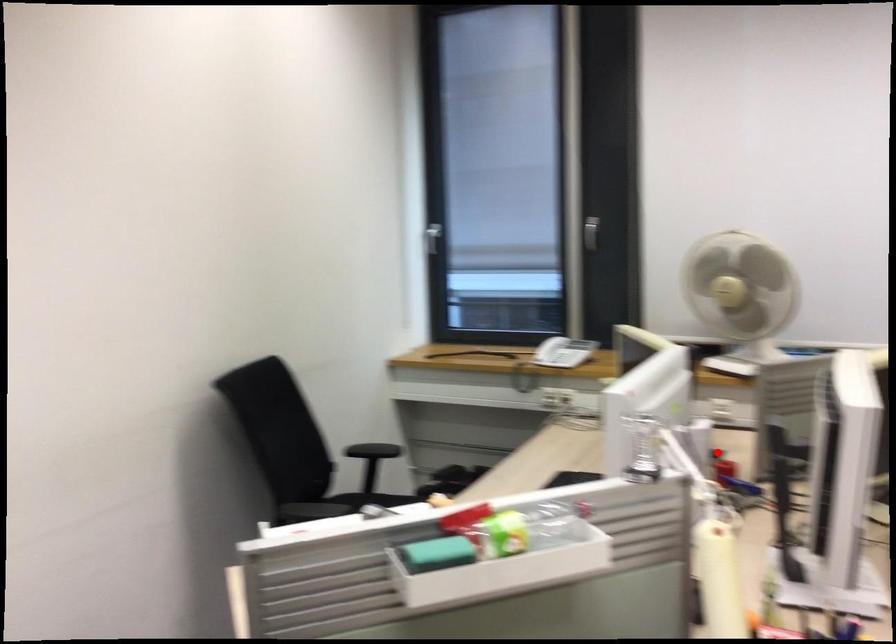
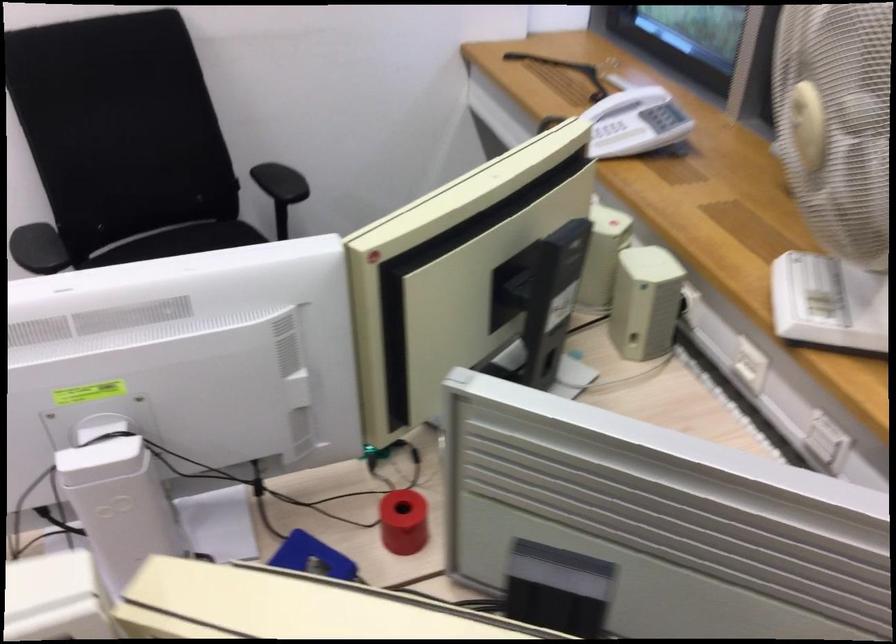
Question: A red point is marked in image1. In image2, is the corresponding 3D point closer to the camera or farther? Reply with the corresponding letter.

Choices:
 (A) The corresponding 3D point is closer.
 (B) The corresponding 3D point is farther.

Answer: (A)